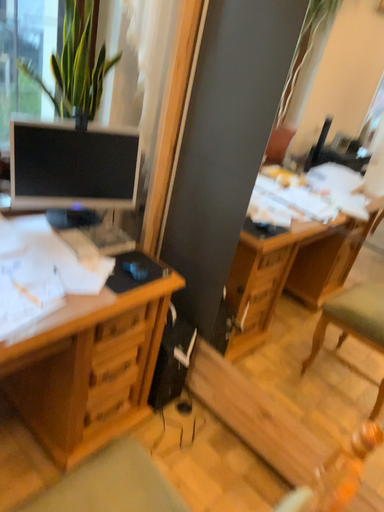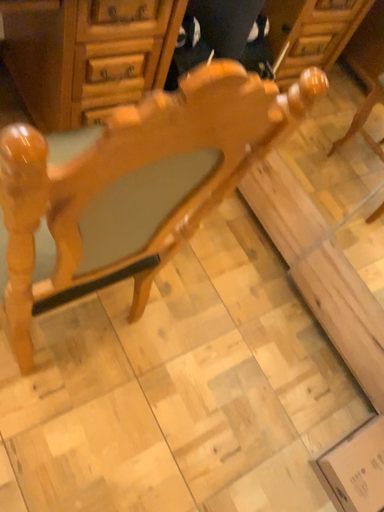
Question: How did the camera likely rotate when shooting the video?

Choices:
 (A) rotated upward
 (B) rotated downward

Answer: (B)